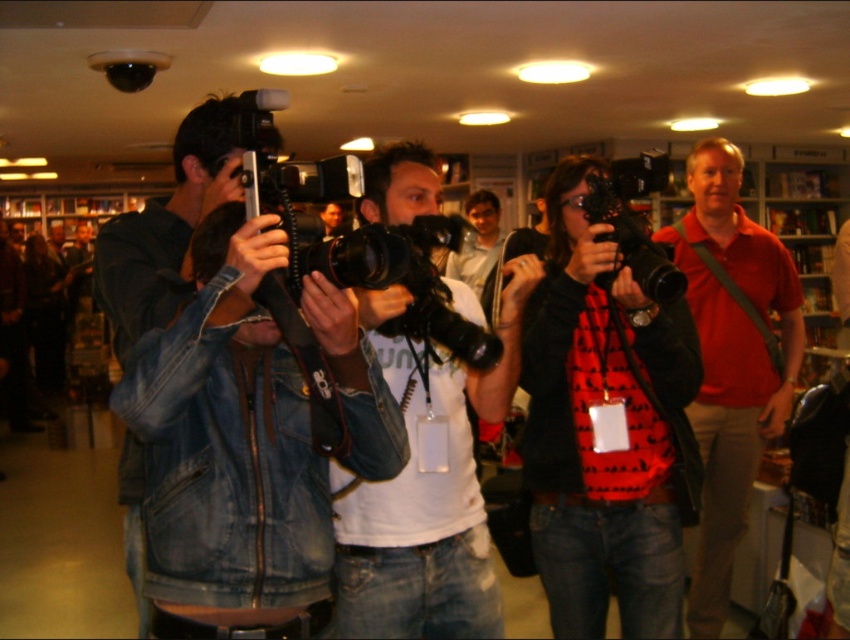
Question: Which point is farther to the camera?

Choices:
 (A) matte black camera at center
 (B) matte red shirt at center

Answer: (B)

Question: Can you confirm if denim jacket at center is bigger than matte black camera at center?

Choices:
 (A) yes
 (B) no

Answer: (B)

Question: In this image, where is denim jacket at center located relative to matte black camera at center?

Choices:
 (A) above
 (B) below

Answer: (A)

Question: Which point appears closest to the camera in this image?

Choices:
 (A) (609, 237)
 (B) (304, 481)
 (C) (745, 355)

Answer: (B)

Question: Which object appears closest to the camera in this image?

Choices:
 (A) white matte t-shirt at center
 (B) matte black camera at center

Answer: (A)

Question: Is matte black camera at center smaller than white matte t-shirt at center?

Choices:
 (A) yes
 (B) no

Answer: (B)